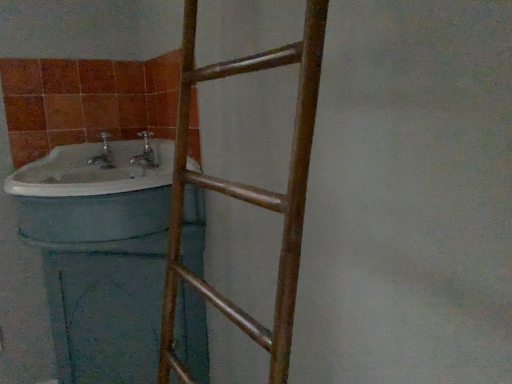
Question: Is brown wooden ladder at center wider than white glossy sink at left?

Choices:
 (A) no
 (B) yes

Answer: (A)

Question: Can we say brown wooden ladder at center lies outside white glossy sink at left?

Choices:
 (A) yes
 (B) no

Answer: (A)

Question: From a real-world perspective, is brown wooden ladder at center located beneath white glossy sink at left?

Choices:
 (A) no
 (B) yes

Answer: (B)

Question: Does brown wooden ladder at center have a smaller size compared to white glossy sink at left?

Choices:
 (A) no
 (B) yes

Answer: (A)

Question: Could white glossy sink at left be considered to be inside brown wooden ladder at center?

Choices:
 (A) yes
 (B) no

Answer: (B)

Question: Is brown wooden ladder at center shorter than white glossy sink at left?

Choices:
 (A) no
 (B) yes

Answer: (A)

Question: Would you say brown wooden ladder at center is part of white glossy sink at left's contents?

Choices:
 (A) no
 (B) yes

Answer: (A)

Question: Considering the relative positions of white glossy sink at left and brown wooden ladder at center in the image provided, is white glossy sink at left to the left of brown wooden ladder at center from the viewer's perspective?

Choices:
 (A) no
 (B) yes

Answer: (B)

Question: From a real-world perspective, is white glossy sink at left over brown wooden ladder at center?

Choices:
 (A) yes
 (B) no

Answer: (A)

Question: Can you confirm if white glossy sink at left is taller than brown wooden ladder at center?

Choices:
 (A) no
 (B) yes

Answer: (A)

Question: From the image's perspective, is white glossy sink at left on brown wooden ladder at center?

Choices:
 (A) yes
 (B) no

Answer: (A)

Question: Considering the relative sizes of white glossy sink at left and brown wooden ladder at center in the image provided, is white glossy sink at left wider than brown wooden ladder at center?

Choices:
 (A) no
 (B) yes

Answer: (B)

Question: Which is correct: brown wooden ladder at center is inside white glossy sink at left, or outside of it?

Choices:
 (A) inside
 (B) outside

Answer: (B)